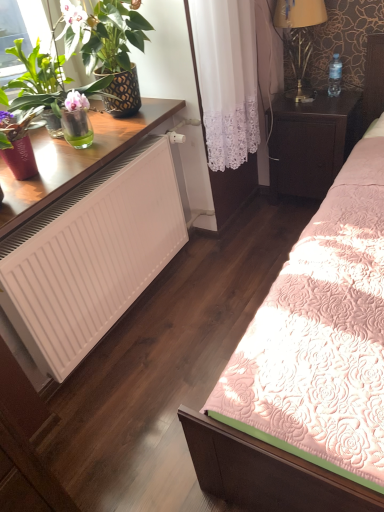
You are a GUI agent. You are given a task and a screenshot of the screen. Output one action in this format:
    pyautogui.click(x=<x>, y=<y>)
    Task: Click on the dark wood nightstand at right
    
    Given the screenshot: What is the action you would take?
    pyautogui.click(x=312, y=142)

Identify the location of pink floral quilt at center. (264, 472).

Describe the element at coordinates (75, 159) in the screenshot. I see `wooden desk at left` at that location.

Measure the distance between white lace curtain at center and camera.

A distance of 5.54 feet exists between white lace curtain at center and camera.

What do you see at coordinates (335, 76) in the screenshot? This screenshot has width=384, height=512. I see `transparent plastic bottle at upper right` at bounding box center [335, 76].

This screenshot has height=512, width=384. What are the coordinates of `matte black pot at left` in the screenshot? It's located at (39, 80).

What is the approximate height of matte black pot at left?

22.42 inches.

This screenshot has width=384, height=512. Identify the location of dark wood nightstand at right. (312, 142).

Does point (23, 53) appear closer or farther from the camera than point (303, 60)?

Point (23, 53) is closer to the camera than point (303, 60).

What's the angular difference between matte black pot at left and gold metallic lamp at upper right's facing directions?

The facing directions of matte black pot at left and gold metallic lamp at upper right are 88.7 degrees apart.

At what (x,y) coordinates should I click in order to perform the action: click on houseplant above the gold metallic lamp at upper right (from a real-world perspective). Please return your answer as a coordinate pair (x, y). This screenshot has width=384, height=512. Looking at the image, I should click on (39, 80).

From their relative heights in the image, would you say transparent plastic bottle at upper right is taller or shorter than white lace curtain at center?

Considering their sizes, transparent plastic bottle at upper right has less height than white lace curtain at center.

Can white lace curtain at center be found inside transparent plastic bottle at upper right?

No.

Is transparent plastic bottle at upper right bigger or smaller than white lace curtain at center?

In the image, transparent plastic bottle at upper right appears to be smaller than white lace curtain at center.

From the image's perspective, which one is positioned lower, transparent plastic bottle at upper right or white lace curtain at center?

white lace curtain at center.

From a real-world perspective, which object stands above the other?

In real-world perspective, transparent plastic bottle at upper right is above.

Based on their positions, is transparent plastic bottle at upper right located to the left or right of pink floral quilt at center?

transparent plastic bottle at upper right is to the right of pink floral quilt at center.

Is dark wood nightstand at right located within wooden desk at left?

No, dark wood nightstand at right is not a part of wooden desk at left.

From the image's perspective, is wooden desk at left beneath dark wood nightstand at right?

Correct, wooden desk at left appears lower than dark wood nightstand at right in the image.

Can you confirm if wooden desk at left is positioned to the right of dark wood nightstand at right?

No.

Which of these two, wooden desk at left or dark wood nightstand at right, is wider?

wooden desk at left is wider.

Is matte black pot at left to the left or to the right of white matte radiator at lower left in the image?

In the image, matte black pot at left appears on the right side of white matte radiator at lower left.

From a real-world perspective, is matte black pot at left physically below white matte radiator at lower left?

No, from a real-world perspective, matte black pot at left is not beneath white matte radiator at lower left.

Which object is thinner, matte black pot at left or white matte radiator at lower left?

matte black pot at left.

This screenshot has width=384, height=512. In order to click on houseplant in front of the white matte radiator at lower left in this screenshot , I will do `click(39, 80)`.

Is point (310, 38) positioned in front of point (74, 221)?

No, it is behind (74, 221).

Are gold metallic lamp at upper right and white matte radiator at lower left beside each other?

No, gold metallic lamp at upper right is not in contact with white matte radiator at lower left.

Consider the image. Which is correct: gold metallic lamp at upper right is inside white matte radiator at lower left, or outside of it?

gold metallic lamp at upper right cannot be found inside white matte radiator at lower left.

Is transparent plastic bottle at upper right taller than dark wood nightstand at right?

No, transparent plastic bottle at upper right is not taller than dark wood nightstand at right.

From a real-world perspective, is transparent plastic bottle at upper right positioned under dark wood nightstand at right based on gravity?

No.

Is transparent plastic bottle at upper right wider or thinner than dark wood nightstand at right?

transparent plastic bottle at upper right is thinner than dark wood nightstand at right.

Is point (338, 92) closer or farther from the camera than point (283, 174)?

Point (338, 92) is closer to the camera than point (283, 174).

Locate an element on the screen. The image size is (384, 512). lamp below the matte black pot at left (from a real-world perspective) is located at coordinates (299, 37).

Locate an element on the screen. The height and width of the screenshot is (512, 384). curtain that appears on the left of transparent plastic bottle at upper right is located at coordinates (227, 78).

Estimate the real-world distances between objects in this image. Which object is further from white lace curtain at center, transparent plastic bottle at upper right or pink floral quilt at center?

pink floral quilt at center is positioned further to the anchor white lace curtain at center.

Which object lies further to the anchor point gold metallic lamp at upper right, white lace curtain at center or pink floral quilt at center?

pink floral quilt at center.

Estimate the real-world distances between objects in this image. Which object is closer to transparent plastic bottle at upper right, wooden desk at left or pink floral quilt at center?

wooden desk at left lies closer to transparent plastic bottle at upper right than the other object.

Looking at the image, which one is located further to pink floral quilt at center, dark wood nightstand at right or transparent plastic bottle at upper right?

transparent plastic bottle at upper right is positioned further to the anchor pink floral quilt at center.

Looking at the image, which one is located closer to matte black pot at left, white lace curtain at center or white matte radiator at lower left?

Based on the image, white matte radiator at lower left appears to be nearer to matte black pot at left.

Estimate the real-world distances between objects in this image. Which object is further from white lace curtain at center, white matte radiator at lower left or dark wood nightstand at right?

white matte radiator at lower left is positioned further to the anchor white lace curtain at center.

From the image, which object appears to be farther from gold metallic lamp at upper right, matte black pot at left or white lace curtain at center?

matte black pot at left is positioned further to the anchor gold metallic lamp at upper right.

Looking at the image, which one is located closer to wooden desk at left, white lace curtain at center or transparent plastic bottle at upper right?

white lace curtain at center lies closer to wooden desk at left than the other object.

Locate an element on the screen. radiator between pink floral quilt at center and dark wood nightstand at right along the z-axis is located at coordinates (91, 256).

The image size is (384, 512). Find the location of `radiator between pink floral quilt at center and transparent plastic bottle at upper right along the z-axis`. radiator between pink floral quilt at center and transparent plastic bottle at upper right along the z-axis is located at coordinates (91, 256).

Locate an element on the screen. curtain between matte black pot at left and transparent plastic bottle at upper right is located at coordinates (227, 78).

I want to click on curtain between matte black pot at left and gold metallic lamp at upper right in the horizontal direction, so click(227, 78).